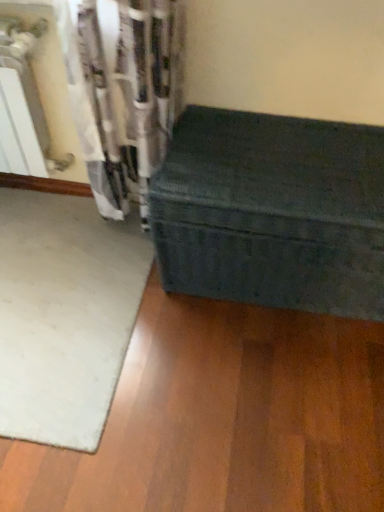
Find the location of a particular element. The height and width of the screenshot is (512, 384). free point above white soft mat at lower left (from a real-world perspective) is located at coordinates (57, 280).